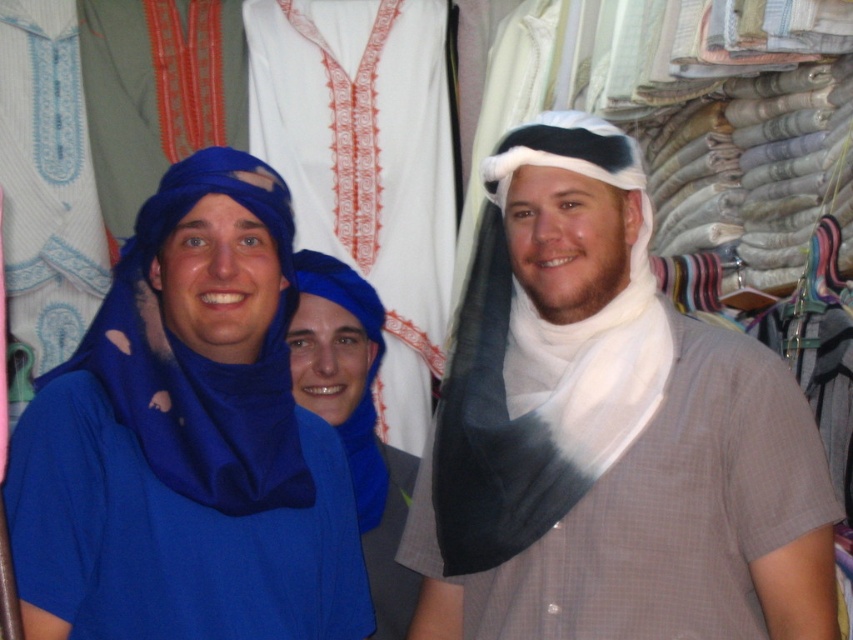
You are a photographer trying to capture a photo of the white sheer scarf at center and the blue soft fabric scarf at left. Based on their positions, which scarf should you focus on first if you want to capture them from left to right order?

The blue soft fabric scarf at left should be focused on first since it is positioned to the left of the white sheer scarf at center, making it the first element in a left to right sequence.

In the scene shown: You are standing 10 meters away from the camera. You want to take a photo of the white sheer scarf at center. Can you reach it by moving forward 1 meter?

The white sheer scarf at center and camera are 9.15 meters apart. Since you are 10 meters away from the camera, moving forward 1 meter would bring you to 9 meters away from the camera, which is closer than the scarf. Therefore, you can reach the white sheer scarf at center by moving forward 1 meter.

You are standing in a clothing store and see two points marked on the floor. One is at point (518, 417) and the other at point (616, 150). Which point is closer to the entrance of the store?

Point (616, 150) is closer to the entrance because point (518, 417) is behind it.